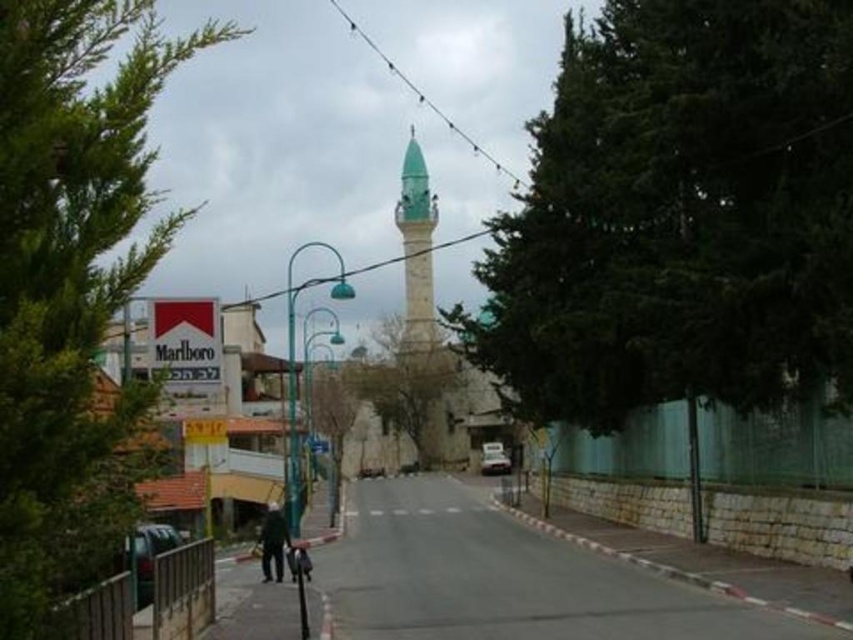
You are a pedestrian standing on the sidewalk and see the green leafy tree at left and the dark gray fabric jacket at center. Which object is closer to your left side?

The green leafy tree at left is closer to your left side because it is positioned on the left side of the dark gray fabric jacket at center.

You are standing at the point closer to the camera. Which point are you at, point (537, 140) or point (45, 444)?

You are at point (45, 444) because it is closer to the camera compared to point (537, 140).